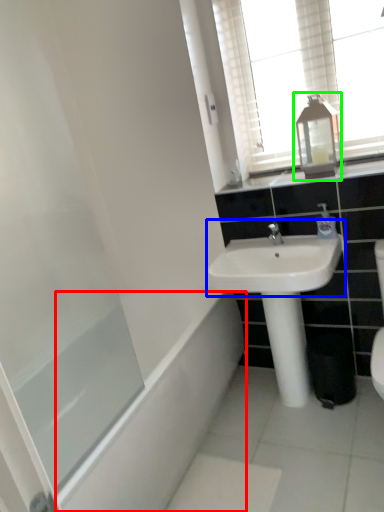
Question: Estimate the real-world distances between objects in this image. Which object is farther from bath (highlighted by a red box), sink (highlighted by a blue box) or medicine cabinet (highlighted by a green box)?

Choices:
 (A) sink
 (B) medicine cabinet

Answer: (B)